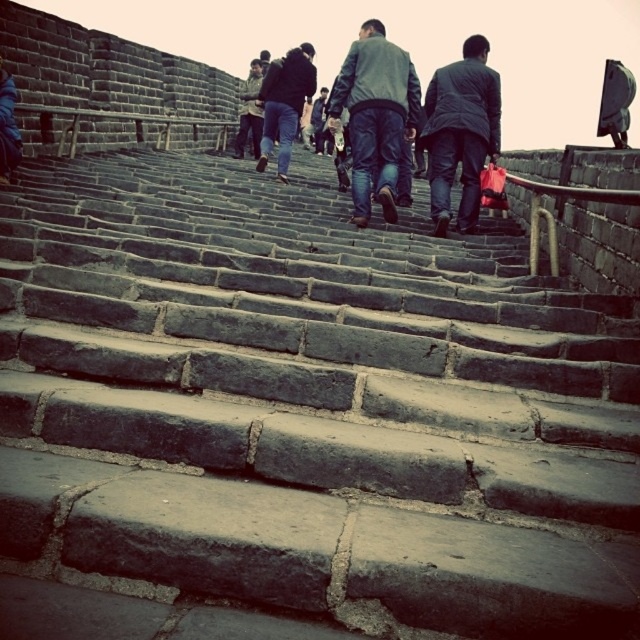
Question: Which of these objects is positioned closest to the dark gray jacket at center?

Choices:
 (A) dark gray jeans at center
 (B) dark blue jeans at center

Answer: (B)

Question: Which point is closer to the camera?

Choices:
 (A) (444, 180)
 (B) (248, 108)
 (C) (314, 70)

Answer: (A)

Question: Is dark gray fabric jacket at center above dark gray jeans at center?

Choices:
 (A) yes
 (B) no

Answer: (B)

Question: Can you confirm if dark gray jacket at center is positioned to the right of dark blue jeans at center?

Choices:
 (A) no
 (B) yes

Answer: (B)

Question: Considering the relative positions of dark gray fabric jacket at center and dark blue jeans at center in the image provided, where is dark gray fabric jacket at center located with respect to dark blue jeans at center?

Choices:
 (A) below
 (B) above

Answer: (A)

Question: Which point is closer to the camera?

Choices:
 (A) dark gray fabric jacket at center
 (B) dark blue jeans at center
 (C) dark gray jacket at center
 (D) dark gray jeans at center

Answer: (C)